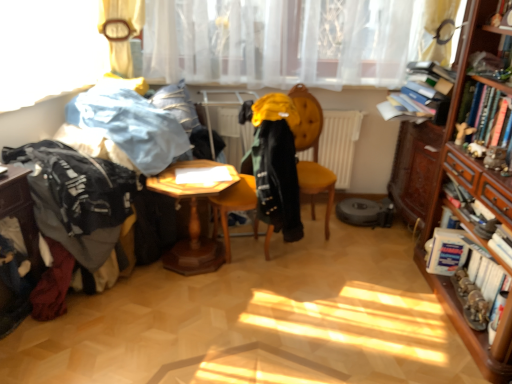
Find the location of a particular element. This screenshot has height=384, width=512. free space to the left of wooden bookcase at right is located at coordinates (362, 309).